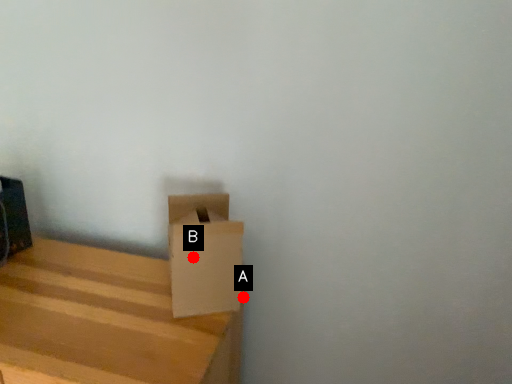
Question: Two points are circled on the image, labeled by A and B beside each circle. Which point is farther to the camera?

Choices:
 (A) A is further
 (B) B is further

Answer: (A)